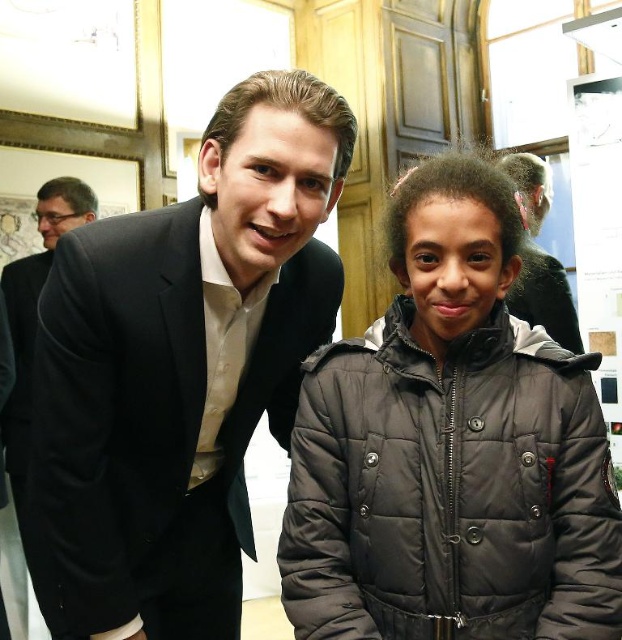
Which is behind, point (337, 148) or point (458, 589)?

Point (337, 148)

Can you confirm if black satin suit at left is thinner than dark gray puffer jacket at center?

No.

At what (x,y) coordinates should I click in order to perform the action: click on black satin suit at left. Please return your answer as a coordinate pair (x, y). Image resolution: width=622 pixels, height=640 pixels. Looking at the image, I should click on (180, 371).

Which is in front, point (193, 328) or point (554, 307)?

Point (193, 328) is in front.

Does black satin suit at left have a greater height compared to matte black suit at center?

Yes, black satin suit at left is taller than matte black suit at center.

Is point (238, 628) less distant than point (564, 284)?

Yes, it is.

Where is `black satin suit at left`? black satin suit at left is located at coordinates (180, 371).

Does point (470, 228) come in front of point (554, 273)?

Yes, point (470, 228) is closer to viewer.

Who is more distant from viewer, (x=309, y=588) or (x=532, y=189)?

Point (x=532, y=189)

Where is `dark gray puffer jacket at center`? The image size is (622, 640). dark gray puffer jacket at center is located at coordinates (450, 449).